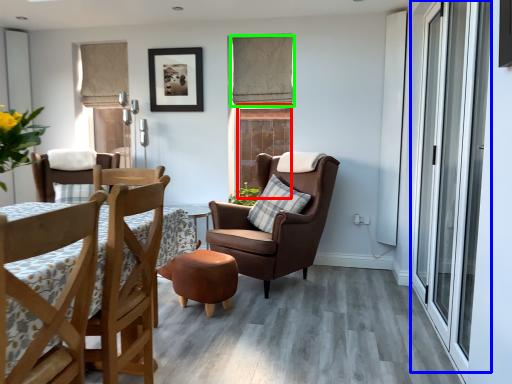
Question: Which is farther away from window (highlighted by a red box)? screen door (highlighted by a blue box) or curtain (highlighted by a green box)?

Choices:
 (A) screen door
 (B) curtain

Answer: (A)